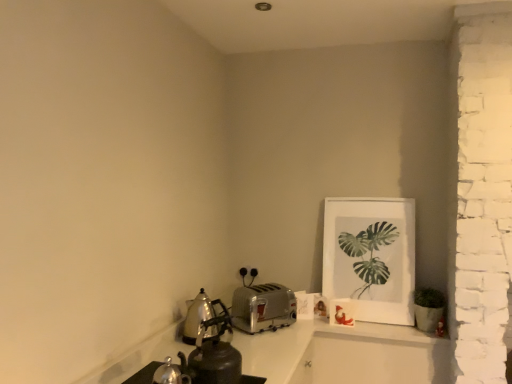
Question: From the image's perspective, relative to shiny metallic kettle at lower left, is polished stainless steel kettle at left, which is the first kitchen appliance in left-to-right order, above or below?

Choices:
 (A) above
 (B) below

Answer: (A)

Question: Which is correct: polished stainless steel kettle at left, the second kitchen appliance positioned from the right, is inside shiny metallic kettle at lower left, or outside of it?

Choices:
 (A) outside
 (B) inside

Answer: (A)

Question: Estimate the real-world distances between objects in this image. Which object is closer to the shiny metallic kettle at lower left?

Choices:
 (A) polished stainless steel kettle at left, the second kitchen appliance positioned from the right
 (B) white matte picture frame at upper right
 (C) silver metallic toaster at center, the first kitchen appliance viewed from the right

Answer: (A)

Question: Which object is positioned closest to the shiny metallic kettle at lower left?

Choices:
 (A) silver metallic toaster at center, the first kitchen appliance viewed from the right
 (B) polished stainless steel kettle at left, which is the first kitchen appliance in left-to-right order
 (C) white matte picture frame at upper right

Answer: (B)